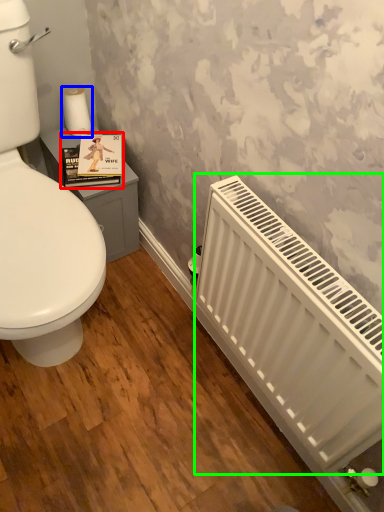
Question: Considering the real-world distances, which object is closest to book cover (highlighted by a red box)? toilet paper (highlighted by a blue box) or radiator (highlighted by a green box).

Choices:
 (A) toilet paper
 (B) radiator

Answer: (A)